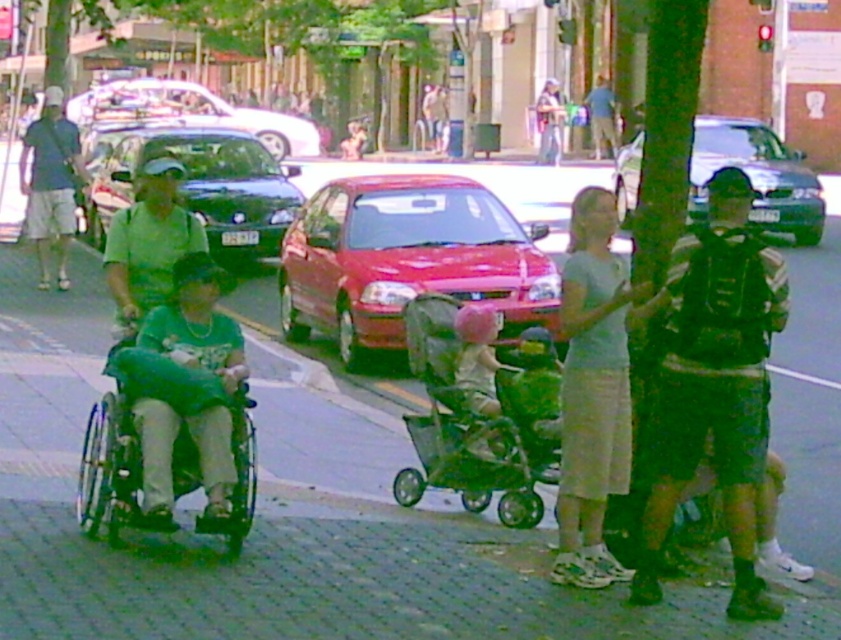
Question: Which of the following is the closest to the observer?

Choices:
 (A) dark blue shirt at left
 (B) green matte shirt at center
 (C) dark green backpack at right
 (D) green fabric stroller at center

Answer: (C)

Question: Which point is closer to the camera?

Choices:
 (A) blue denim shirt at upper center
 (B) green matte shirt at center
 (C) white glossy car at upper center

Answer: (B)

Question: Does shiny red car at center have a smaller size compared to blue denim shirt at upper center?

Choices:
 (A) yes
 (B) no

Answer: (B)

Question: Is metallic silver wheelchair at left smaller than white glossy car at upper center?

Choices:
 (A) no
 (B) yes

Answer: (B)

Question: Which point is closer to the camera?

Choices:
 (A) (210, 182)
 (B) (567, 268)

Answer: (B)

Question: Does metallic silver sedan at center lie in front of blue denim shirt at upper center?

Choices:
 (A) yes
 (B) no

Answer: (A)